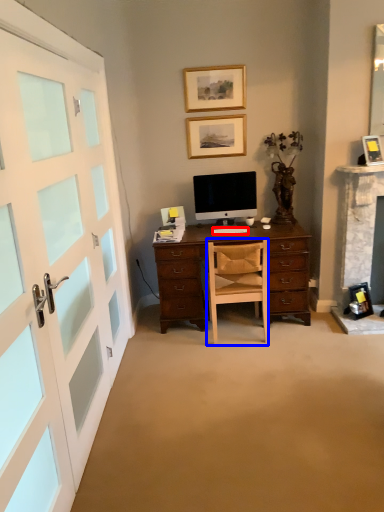
Question: Among these objects, which one is nearest to the camera, computer keyboard (highlighted by a red box) or chair (highlighted by a blue box)?

Choices:
 (A) computer keyboard
 (B) chair

Answer: (B)